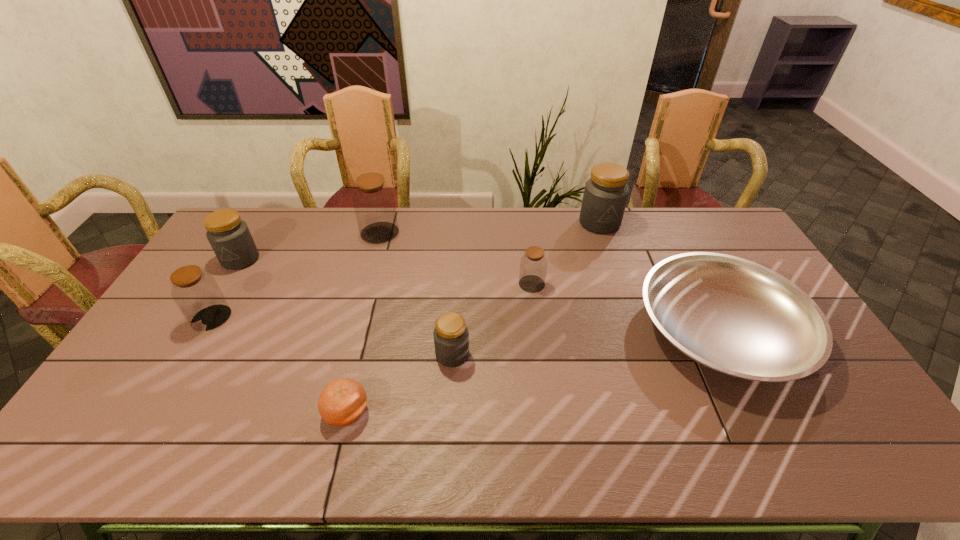
Find the location of `the third jar from left to right`. the third jar from left to right is located at coordinates (374, 204).

Find the location of a particular element. This screenshot has width=960, height=540. the farthest brown jar is located at coordinates (374, 204).

Identify the location of the rightmost gray jar. The image size is (960, 540). (605, 196).

Where is `the rightmost jar`? The height and width of the screenshot is (540, 960). the rightmost jar is located at coordinates 605,196.

In order to click on the leftmost brown jar in this screenshot , I will do `click(198, 296)`.

Image resolution: width=960 pixels, height=540 pixels. In order to click on the nearest brown jar in this screenshot , I will do `click(198, 296)`.

Where is `the leftmost gray jar`? Image resolution: width=960 pixels, height=540 pixels. the leftmost gray jar is located at coordinates (229, 236).

This screenshot has width=960, height=540. I want to click on the third farthest object, so pos(229,236).

Find the location of a particular element. The image size is (960, 540). the smallest brown jar is located at coordinates (533, 266).

Identify the location of the second farthest brown jar. This screenshot has width=960, height=540. (533, 266).